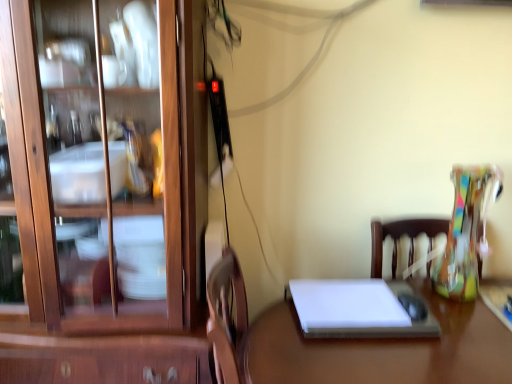
Identify the location of vacant area on top of white matte notebook at center (from a real-world perspective). This screenshot has width=512, height=384. (360, 300).